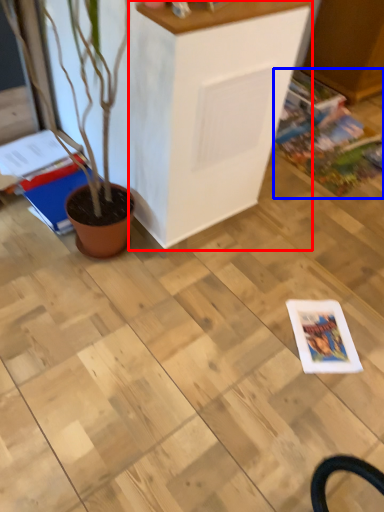
Question: Which object appears closest to the camera in this image, furniture (highlighted by a red box) or comic book (highlighted by a blue box)?

Choices:
 (A) furniture
 (B) comic book

Answer: (A)